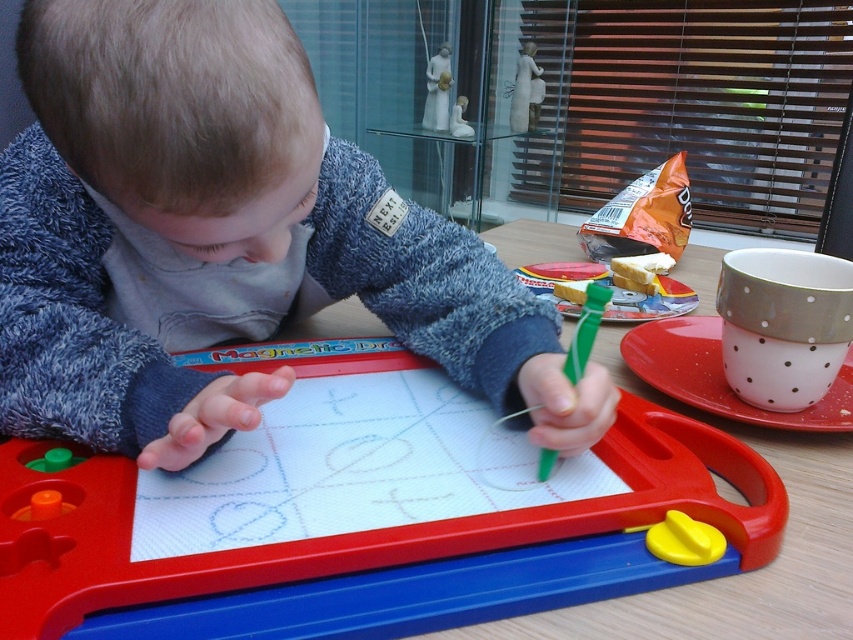
You are a photographer trying to take a picture of the soft blue sweater at center. You have a camera that can focus on objects within 12 inches. Is the camera close enough to the sweater to take a clear photo?

The soft blue sweater at center and camera are 12.88 inches apart from each other. Since the camera can focus within 12 inches, the distance of 12.88 inches is slightly beyond its focusing range. Therefore, the camera is not close enough to take a clear photo of the soft blue sweater at center.

In the scene shown: You are a parent trying to ensure your child can reach both the wooden table at center and the green plastic crayon at center while drawing. Can the child comfortably reach both items without moving their position?

The distance between the wooden table at center and the green plastic crayon at center is 12.18 inches, so the child can comfortably reach both items without moving their position since the distance is within a typical comfortable reaching range for a child.

You are a parent standing in front of the table where the soft blue sweater at center is placed. You want to pick up the sweater without moving any other items on the table. Is there enough space between you and the sweater to do so?

The soft blue sweater at center and the viewer are 12.88 inches apart. Since 12.88 inches is approximately 32.7 cm, there is sufficient space for a parent to reach and pick up the sweater without disturbing other items on the table.